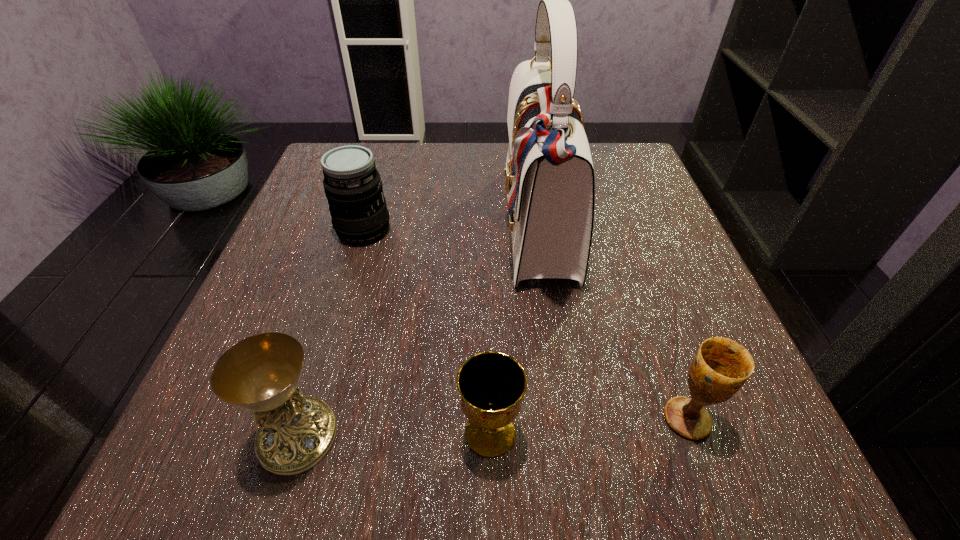
You are a GUI agent. You are given a task and a screenshot of the screen. Output one action in this format:
    pyautogui.click(x=<x>, y=<y>)
    Task: Click on the free space at the left edge
    
    Given the screenshot: What is the action you would take?
    pyautogui.click(x=260, y=301)

This screenshot has width=960, height=540. In the image, there is a desktop. Identify the location of vacant region at the far left corner. (379, 147).

Image resolution: width=960 pixels, height=540 pixels. Find the location of `free space at the far right corner of the desktop`. free space at the far right corner of the desktop is located at coordinates (621, 153).

I want to click on blank region between the second chalice from left to right and the rightmost object, so click(x=588, y=426).

I want to click on empty space between the second chalice from left to right and the telephoto lens, so click(427, 331).

Locate an element on the screen. The height and width of the screenshot is (540, 960). free space between the rightmost chalice and the tallest object is located at coordinates (613, 323).

This screenshot has height=540, width=960. I want to click on empty location between the second chalice from right to left and the satchel, so click(515, 330).

You are a GUI agent. You are given a task and a screenshot of the screen. Output one action in this format:
    pyautogui.click(x=<x>, y=<y>)
    Task: Click on the vacant area that lies between the second chalice from right to left and the telephoto lens
    This screenshot has width=960, height=540.
    Given the screenshot: What is the action you would take?
    pyautogui.click(x=427, y=331)

At what (x,y) coordinates should I click in order to perform the action: click on free space between the rightmost chalice and the satchel. Please return your answer as a coordinate pair (x, y). This screenshot has height=540, width=960. Looking at the image, I should click on (613, 323).

Image resolution: width=960 pixels, height=540 pixels. Identify the location of vacant space in between the leftmost chalice and the tallest object. coord(419,332).